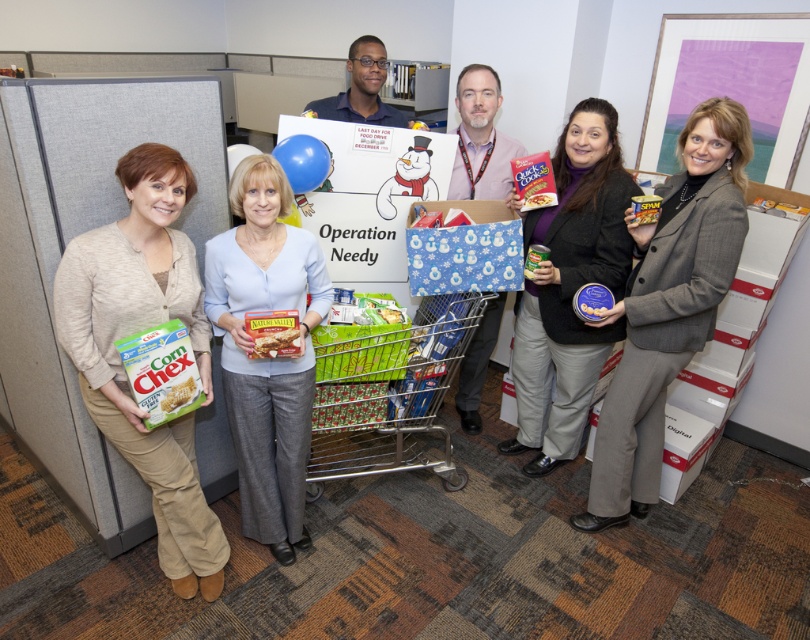
You are standing in the office where the food drive event is happening. You need to place a new sign between the two points marked as point (152,212) and point (195,388). Which point should the sign be closer to in order to be more visible to people entering the room?

The sign should be placed closer to point (152,212) because it is closer to the viewer, making it more visible to people entering the room.

Looking at this image, you are standing at the position of the camera and looking at the scene. Which of the two points, point 1 at coordinates (604, 401) or point 2 at (177, 406), is closer to you?

Point 1 at coordinates (604, 401) is closer to you because it is further to the camera than point 2 at (177, 406).